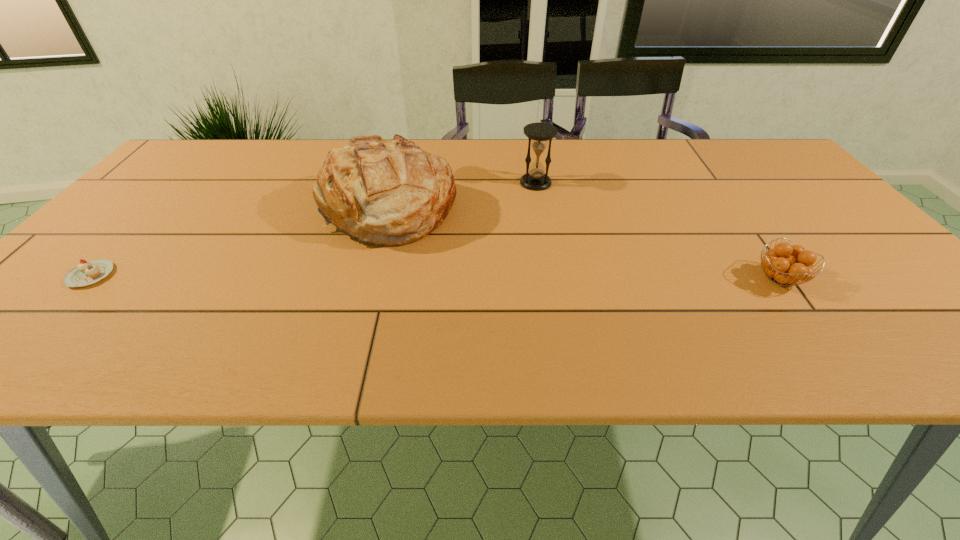
In the image, there is a desktop. At what (x,y) coordinates should I click in order to perform the action: click on vacant space at the far right corner. Please return your answer as a coordinate pair (x, y). Looking at the image, I should click on (733, 145).

Find the location of a particular element. The width and height of the screenshot is (960, 540). empty location between the third object from left to right and the rightmost object is located at coordinates (658, 231).

Locate an element on the screen. This screenshot has width=960, height=540. free spot between the second tallest object and the tallest object is located at coordinates (463, 197).

Where is `unoccupied position between the third shortest object and the leftmost object`? This screenshot has width=960, height=540. unoccupied position between the third shortest object and the leftmost object is located at coordinates (313, 229).

Where is `free space between the orange fruit and the leftmost object`? free space between the orange fruit and the leftmost object is located at coordinates (435, 277).

Find the location of a particular element. The height and width of the screenshot is (540, 960). free space between the second object from left to right and the orange fruit is located at coordinates (585, 245).

What are the coordinates of `free space that is in between the hourglass and the tallest object` in the screenshot? It's located at (463, 197).

Find the location of a particular element. unoccupied position between the leftmost object and the third shortest object is located at coordinates (313, 229).

Locate an element on the screen. This screenshot has width=960, height=540. vacant area that lies between the shortest object and the tallest object is located at coordinates (240, 243).

Find the location of a particular element. The height and width of the screenshot is (540, 960). vacant space in between the second object from left to right and the shortest object is located at coordinates 240,243.